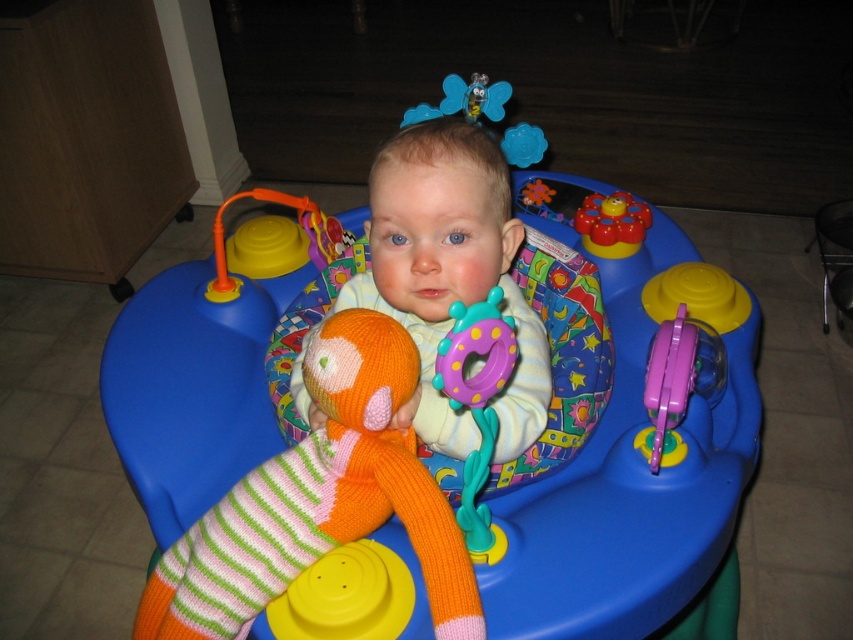
Question: Does rubberized purple phone at center right have a lesser width compared to rubberized yellow flower at center?

Choices:
 (A) no
 (B) yes

Answer: (A)

Question: Which of the following is the farthest from the observer?

Choices:
 (A) purple rubber teething ring at center
 (B) orange knitted sock at center
 (C) rubberized yellow flower at center
 (D) rubberized purple phone at center right

Answer: (C)

Question: Among these objects, which one is nearest to the camera?

Choices:
 (A) orange knitted sock at center
 (B) rubberized purple phone at center right
 (C) rubberized yellow flower at center
 (D) purple rubber teething ring at center

Answer: (D)

Question: Does rubberized purple phone at center right appear under rubberized yellow flower at center?

Choices:
 (A) yes
 (B) no

Answer: (A)

Question: Can you confirm if purple rubber teething ring at center is positioned above rubberized yellow flower at center?

Choices:
 (A) no
 (B) yes

Answer: (A)

Question: Which point is closer to the camera?

Choices:
 (A) rubberized purple phone at center right
 (B) orange knitted sock at center
 (C) purple rubber teething ring at center

Answer: (C)